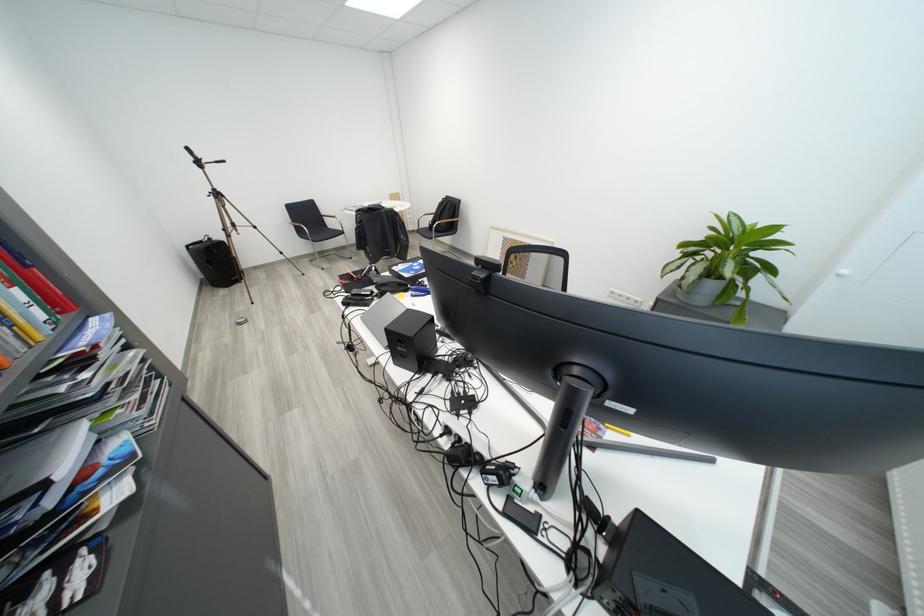
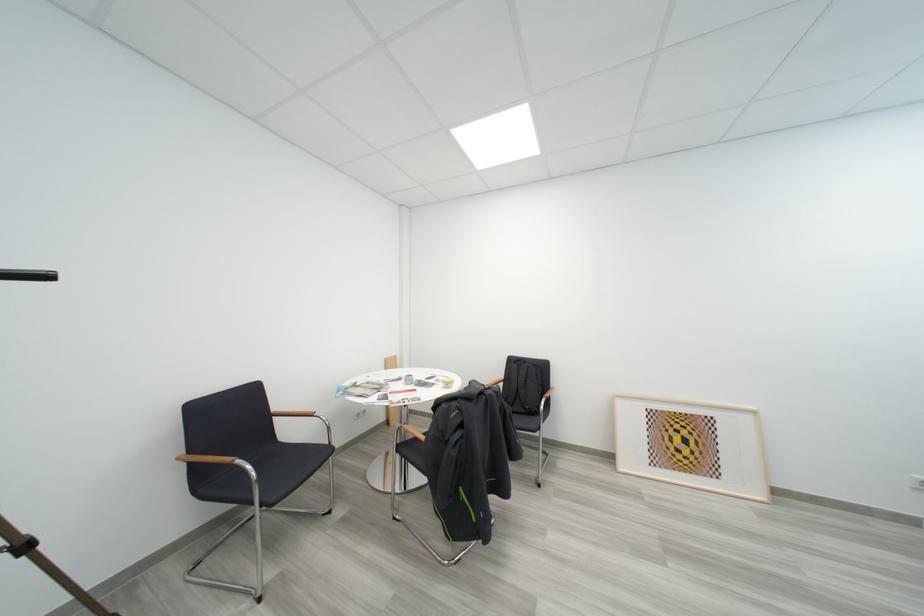
Find the pixel in the second image that matches point (444, 213) in the first image.

(512, 381)